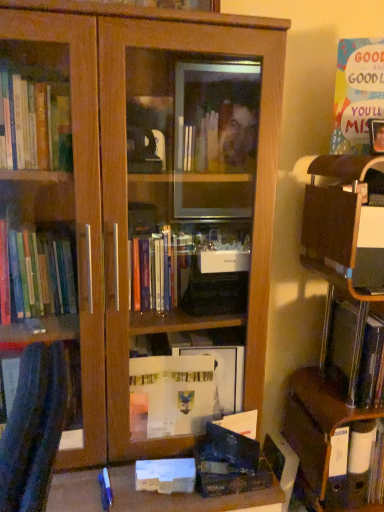
In order to face white matte paperback book at lower center, which is the first paperback book in bottom-to-top order, should I rotate leftwards or rightwards?

To align with it, rotate left about 3.462°.

At what (x,y) coordinates should I click in order to perform the action: click on wooden desk at right. Please return your answer as a coordinate pair (x, y). Image resolution: width=384 pixels, height=512 pixels. Looking at the image, I should click on (342, 340).

Where is `matte brown cabinet at lower right`? matte brown cabinet at lower right is located at coordinates (323, 438).

Measure the distance between matte black paperback book at lower center, the 2th paperback book in the right-to-left sequence, and camera.

matte black paperback book at lower center, the 2th paperback book in the right-to-left sequence, is 1.12 meters away from camera.

Locate an element on the screen. metallic silver book at right is located at coordinates (355, 353).

Find the location of a particular element. Image resolution: width=384 pixels, height=512 pixels. white matte paperback book at lower center, which is the 1th paperback book from left to right is located at coordinates (166, 475).

From the image's perspective, which one is positioned lower, metallic silver book at right or white matte paperback book at lower center, which is the first paperback book in bottom-to-top order?

white matte paperback book at lower center, which is the first paperback book in bottom-to-top order, from the image's perspective.

There is a metallic silver book at right. At what (x,y) coordinates should I click in order to perform the action: click on the 2nd paperback book below it (from the image's perspective). Please return your answer as a coordinate pair (x, y). This screenshot has height=512, width=384. Looking at the image, I should click on (166, 475).

Is metallic silver book at right oriented towards white matte paperback book at lower center, which ranks as the third paperback book in top-to-bottom order?

No, metallic silver book at right is not oriented towards white matte paperback book at lower center, which ranks as the third paperback book in top-to-bottom order.

Considering the sizes of metallic silver book at right and white matte paperback book at lower center, which is the first paperback book in bottom-to-top order, in the image, is metallic silver book at right taller or shorter than white matte paperback book at lower center, which is the first paperback book in bottom-to-top order,?

→ Clearly, metallic silver book at right is taller compared to white matte paperback book at lower center, which is the first paperback book in bottom-to-top order.

Is multicolored paper at upper right, arranged as the first paperback book when viewed from the top, inside the boundaries of white matte paperback book at lower center, which is the 1th paperback book from left to right, or outside?

multicolored paper at upper right, arranged as the first paperback book when viewed from the top, is located beyond the bounds of white matte paperback book at lower center, which is the 1th paperback book from left to right.

Is multicolored paper at upper right, the first paperback book positioned from the right, placed right next to white matte paperback book at lower center, which is the 1th paperback book from left to right?

multicolored paper at upper right, the first paperback book positioned from the right, is not next to white matte paperback book at lower center, which is the 1th paperback book from left to right, and they're not touching.

Does point (362, 75) appear closer or farther from the camera than point (180, 483)?

Point (362, 75) is farther from the camera than point (180, 483).

Considering the sizes of objects multicolored paper at upper right, the third paperback book ordered from the bottom, and white matte paperback book at lower center, which is the 3th paperback book from right to left, in the image provided, who is smaller, multicolored paper at upper right, the third paperback book ordered from the bottom, or white matte paperback book at lower center, which is the 3th paperback book from right to left,?

white matte paperback book at lower center, which is the 3th paperback book from right to left, is smaller.

Find the location of a particular element. bookcase in front of the multicolored paper at upper right, arranged as the first paperback book when viewed from the top is located at coordinates (140, 213).

Can you tell me how much multicolored paper at upper right, the first paperback book positioned from the right, and wooden bookcase at center differ in facing direction?

25.5 degrees.

In the scene shown: Can you confirm if multicolored paper at upper right, the third paperback book ordered from the bottom, is positioned to the right of wooden bookcase at center?

Correct, you'll find multicolored paper at upper right, the third paperback book ordered from the bottom, to the right of wooden bookcase at center.

Is multicolored paper at upper right, the third paperback book ordered from the bottom, oriented away from wooden bookcase at center?

multicolored paper at upper right, the third paperback book ordered from the bottom, does not have its back to wooden bookcase at center.

What are the coordinates of `shelf below the metallic silver book at right (from a real-world perspective)` in the screenshot? It's located at 342,340.

Is metallic silver book at right further to camera compared to wooden desk at right?

Yes, the depth of metallic silver book at right is greater than that of wooden desk at right.

Is metallic silver book at right directly adjacent to wooden desk at right?

Yes, metallic silver book at right is touching wooden desk at right.

Would you say metallic silver book at right is inside or outside wooden desk at right?

metallic silver book at right is enclosed within wooden desk at right.

Is matte brown cabinet at lower right inside or outside of wooden bookcase at center?

matte brown cabinet at lower right is outside wooden bookcase at center.

The image size is (384, 512). Find the location of `cabinetry on the right of wooden bookcase at center`. cabinetry on the right of wooden bookcase at center is located at coordinates (323, 438).

Between point (296, 445) and point (193, 85), which one is positioned in front?

The point (193, 85) is more forward.

Is matte brown cabinet at lower right looking in the opposite direction of wooden bookcase at center?

matte brown cabinet at lower right does not have its back to wooden bookcase at center.

Are multicolored paper at upper right, the 3th paperback book from the left, and matte brown cabinet at lower right far apart?

No.

Locate an element on the screen. The image size is (384, 512). cabinetry behind the multicolored paper at upper right, the third paperback book ordered from the bottom is located at coordinates coord(323,438).

Which point is more forward, (346,118) or (328,454)?

The point (346,118) is closer to the camera.

Which is behind, multicolored paper at upper right, arranged as the first paperback book when viewed from the top, or matte brown cabinet at lower right?

matte brown cabinet at lower right is further from the camera.

From the image's perspective, is matte brown cabinet at lower right under metallic silver book at right?

Yes, from the image's perspective, matte brown cabinet at lower right is below metallic silver book at right.

From a real-world perspective, does matte brown cabinet at lower right sit lower than metallic silver book at right?

Yes, from a real-world perspective, matte brown cabinet at lower right is beneath metallic silver book at right.

Which of these two, matte brown cabinet at lower right or metallic silver book at right, is wider?

With larger width is matte brown cabinet at lower right.

From the metallic silver book at right, count 2nd paperback books forward and point to it. Please provide its 2D coordinates.

[(166, 475)]

There is a multicolored paper at upper right, arranged as the first paperback book when viewed from the top. Where is `the 2nd paperback book below it (from a real-world perspective)`? the 2nd paperback book below it (from a real-world perspective) is located at coordinates (166, 475).

Which object lies nearer to the anchor point multicolored paper at upper right, the 3th paperback book from the left, wooden bookcase at center or wooden desk at right?

wooden desk at right is positioned closer to the anchor multicolored paper at upper right, the 3th paperback book from the left.

From the image, which object appears to be nearer to matte black paperback book at lower center, the second paperback book positioned from the top, white matte paperback book at lower center, which is the 1th paperback book from left to right, or wooden desk at right?

Among the two, white matte paperback book at lower center, which is the 1th paperback book from left to right, is located nearer to matte black paperback book at lower center, the second paperback book positioned from the top.

From the image, which object appears to be nearer to white matte paperback book at lower center, which is the first paperback book in bottom-to-top order, matte black paperback book at lower center, the 2th paperback book in the right-to-left sequence, or wooden bookcase at center?

The object closer to white matte paperback book at lower center, which is the first paperback book in bottom-to-top order, is matte black paperback book at lower center, the 2th paperback book in the right-to-left sequence.

Looking at the image, which one is located closer to metallic silver book at right, wooden desk at right or matte brown cabinet at lower right?

wooden desk at right.

From the image, which object appears to be farther from metallic silver book at right, matte black paperback book at lower center, positioned as the second paperback book in bottom-to-top order, or white matte paperback book at lower center, which is the 1th paperback book from left to right?

The object further to metallic silver book at right is white matte paperback book at lower center, which is the 1th paperback book from left to right.

When comparing their distances from matte black paperback book at lower center, positioned as the second paperback book in bottom-to-top order, does wooden bookcase at center or metallic silver book at right seem closer?

The object closer to matte black paperback book at lower center, positioned as the second paperback book in bottom-to-top order, is metallic silver book at right.

When comparing their distances from matte black paperback book at lower center, the 2th paperback book when ordered from left to right, does white matte paperback book at lower center, which is the first paperback book in bottom-to-top order, or wooden bookcase at center seem closer?

white matte paperback book at lower center, which is the first paperback book in bottom-to-top order.

From the picture: When comparing their distances from metallic silver book at right, does white matte paperback book at lower center, which ranks as the third paperback book in top-to-bottom order, or matte black paperback book at lower center, the 2th paperback book when ordered from left to right, seem closer?

matte black paperback book at lower center, the 2th paperback book when ordered from left to right, lies closer to metallic silver book at right than the other object.

The width and height of the screenshot is (384, 512). I want to click on bookcase between multicolored paper at upper right, the first paperback book positioned from the right, and matte black paperback book at lower center, the 2th paperback book in the right-to-left sequence, in the up-down direction, so click(140, 213).

This screenshot has height=512, width=384. Identify the location of paperback book between white matte paperback book at lower center, which is the first paperback book in bottom-to-top order, and matte brown cabinet at lower right. (235, 440).

This screenshot has height=512, width=384. Find the location of `book between multicolored paper at upper right, the 3th paperback book from the left, and wooden desk at right vertically`. book between multicolored paper at upper right, the 3th paperback book from the left, and wooden desk at right vertically is located at coordinates (355, 353).

Where is `paperback book located between wooden bookcase at center and white matte paperback book at lower center, which is the first paperback book in bottom-to-top order, in the depth direction`? Image resolution: width=384 pixels, height=512 pixels. paperback book located between wooden bookcase at center and white matte paperback book at lower center, which is the first paperback book in bottom-to-top order, in the depth direction is located at coordinates (235, 440).